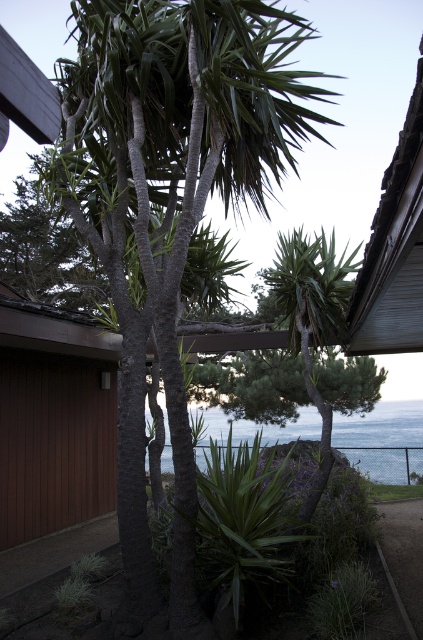
Question: Which point is farther to the camera?

Choices:
 (A) blue water at center
 (B) green textured palm tree at center

Answer: (A)

Question: Is green textured palm tree at center bigger than blue water at center?

Choices:
 (A) yes
 (B) no

Answer: (B)

Question: Considering the relative positions of green textured palm tree at center and blue water at center in the image provided, where is green textured palm tree at center located with respect to blue water at center?

Choices:
 (A) below
 (B) above

Answer: (B)

Question: In this image, where is green textured palm tree at center located relative to blue water at center?

Choices:
 (A) above
 (B) below

Answer: (A)